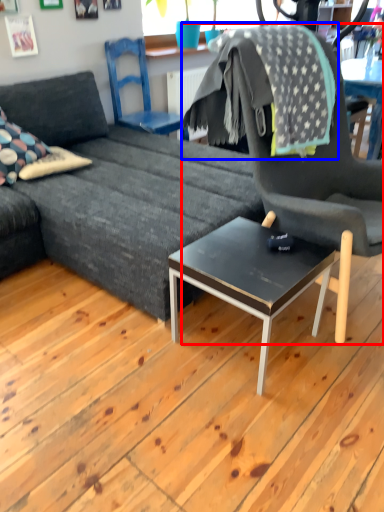
Question: Which of the following is the farthest to the observer, chair (highlighted by a red box) or blanket (highlighted by a blue box)?

Choices:
 (A) chair
 (B) blanket

Answer: (B)